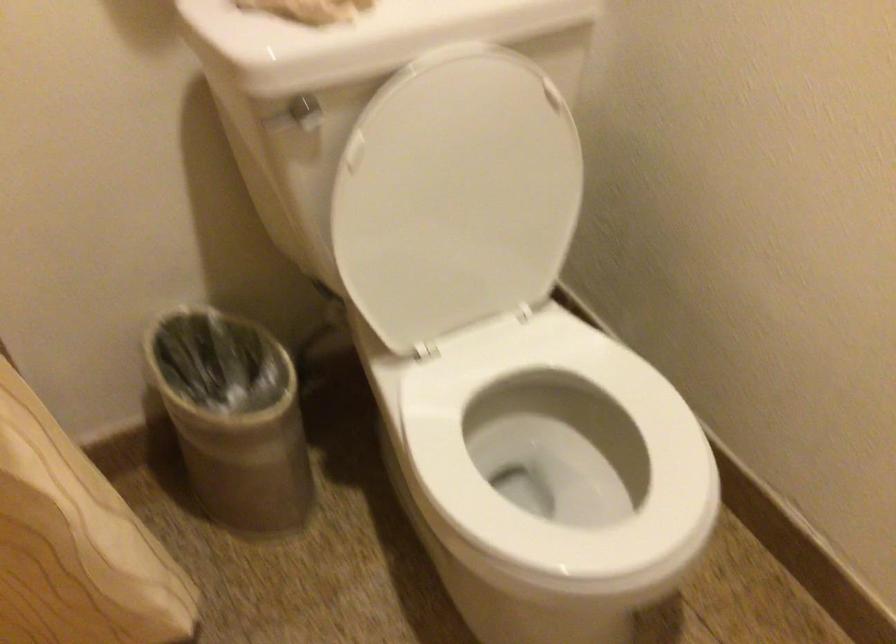
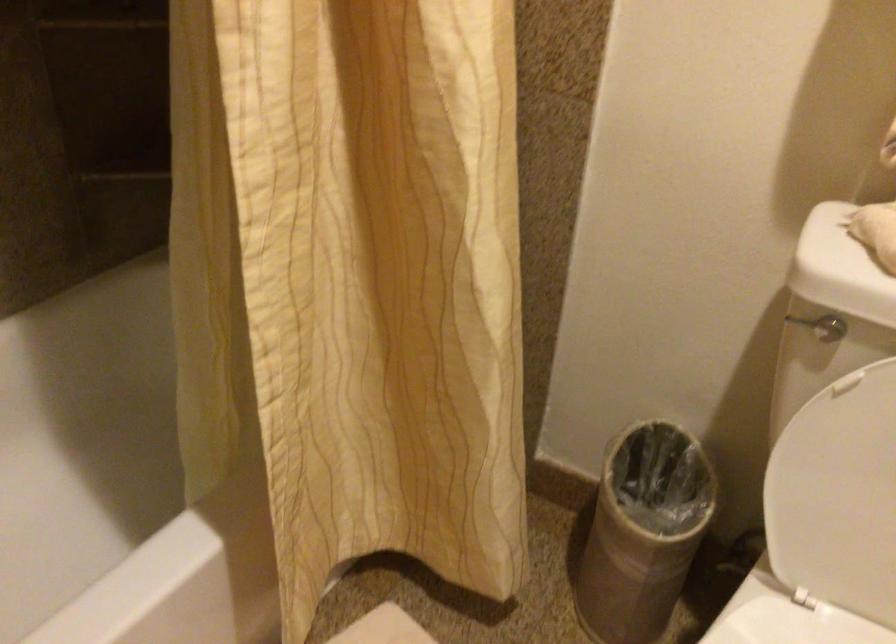
Where in the second image is the point corresponding to point 392,245 from the first image?

(834, 480)